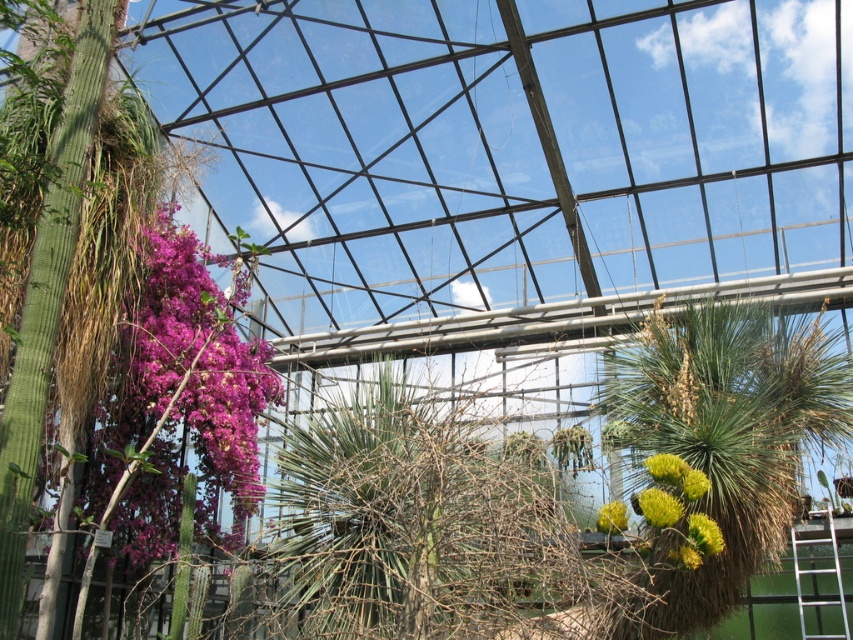
Question: Is purple matte flowers at left wider than yellow fuzzy flower at center?

Choices:
 (A) no
 (B) yes

Answer: (B)

Question: From the image, what is the correct spatial relationship of purple matte flowers at left in relation to yellow fuzzy flower at center?

Choices:
 (A) right
 (B) left

Answer: (B)

Question: Is purple matte flowers at left smaller than yellow fuzzy flower at center?

Choices:
 (A) no
 (B) yes

Answer: (A)